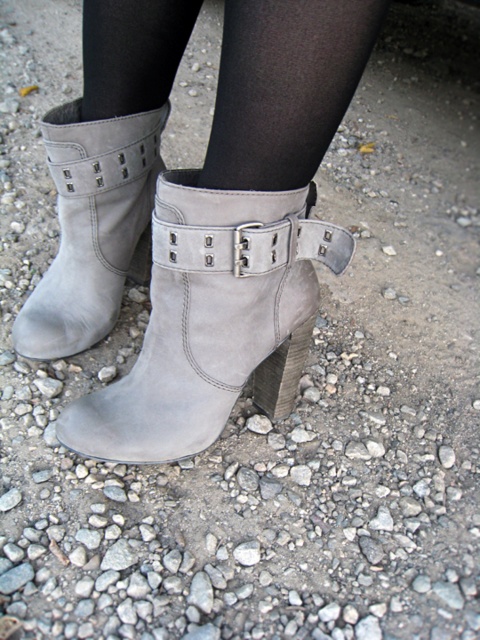
Question: Which point appears farthest from the camera in this image?

Choices:
 (A) (122, 22)
 (B) (308, 202)
 (C) (69, 104)

Answer: (C)

Question: Which point is farther from the camera taking this photo?

Choices:
 (A) (51, 276)
 (B) (312, 273)
 (C) (327, 140)

Answer: (A)

Question: Does suede gray boot at center lie in front of suede gray boot at lower center?

Choices:
 (A) yes
 (B) no

Answer: (A)

Question: Which point appears farthest from the camera in this image?

Choices:
 (A) (204, 312)
 (B) (251, 45)

Answer: (A)

Question: Is suede gray boot at center thinner than suede boot at center?

Choices:
 (A) yes
 (B) no

Answer: (A)

Question: Does suede boot at center have a lesser width compared to suede gray boot at lower center?

Choices:
 (A) yes
 (B) no

Answer: (B)